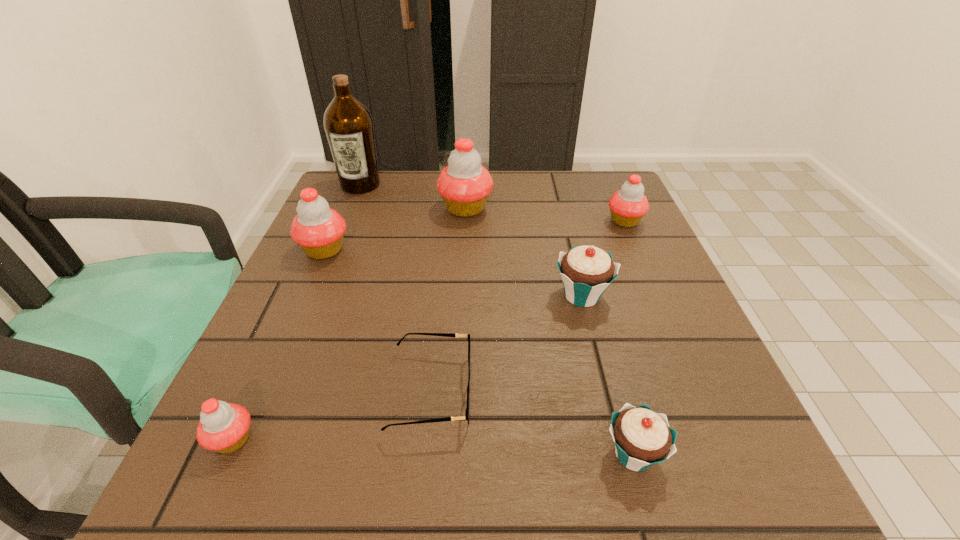
Where is `the smaller teal cupcake`? This screenshot has height=540, width=960. the smaller teal cupcake is located at coordinates (642, 438).

Locate an element on the screen. The width and height of the screenshot is (960, 540). the smallest red cupcake is located at coordinates (224, 427).

Where is `the shortest object`? the shortest object is located at coordinates (467, 411).

The height and width of the screenshot is (540, 960). Find the location of `vacant space situated on the label of the tallest object`. vacant space situated on the label of the tallest object is located at coordinates (344, 226).

The height and width of the screenshot is (540, 960). Identify the location of free space located on the right of the tallest cupcake. (553, 208).

This screenshot has width=960, height=540. I want to click on free space located on the right of the third smallest red cupcake, so click(x=441, y=250).

In order to click on blank space located on the front of the second smallest red cupcake in this screenshot , I will do `click(686, 363)`.

You are a GUI agent. You are given a task and a screenshot of the screen. Output one action in this format:
    pyautogui.click(x=<x>, y=<y>)
    Task: Click on the free point located 0.100m on the front of the fourth farthest cupcake
    This screenshot has height=540, width=960.
    Given the screenshot: What is the action you would take?
    pyautogui.click(x=598, y=359)

Find the location of a particular element. The width and height of the screenshot is (960, 540). vacant region located 0.300m on the left of the nearer teal cupcake is located at coordinates (390, 454).

You are a GUI agent. You are given a task and a screenshot of the screen. Output one action in this format:
    pyautogui.click(x=<x>, y=<y>)
    Task: Click on the vacant space located on the right of the nearest red cupcake
    The height and width of the screenshot is (540, 960).
    Given the screenshot: What is the action you would take?
    pyautogui.click(x=518, y=440)